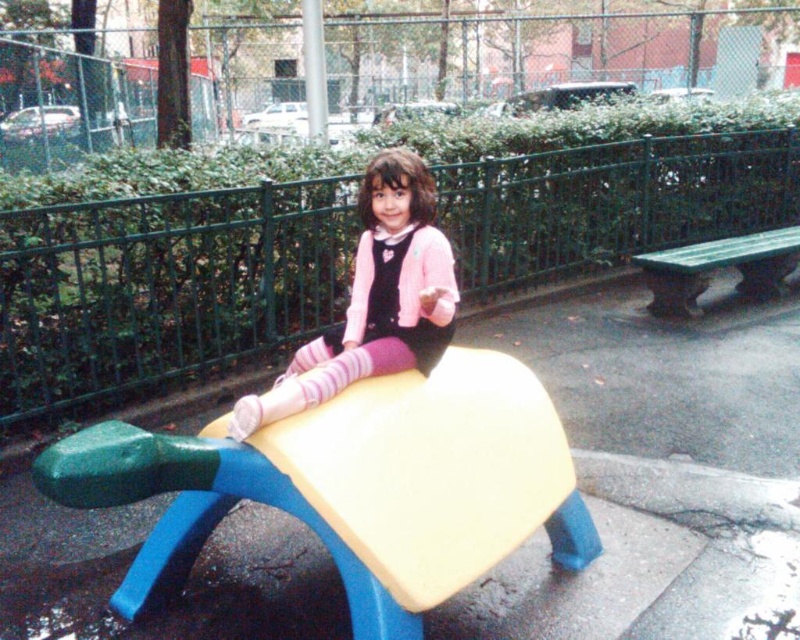
Question: Which object is the closest to the pink matte sweater at center?

Choices:
 (A) green plastic bench at right
 (B) yellow plastic bench at center

Answer: (B)

Question: Considering the real-world distances, which object is farthest from the pink matte sweater at center?

Choices:
 (A) yellow plastic bench at center
 (B) green plastic bench at right

Answer: (B)

Question: Can you confirm if pink matte sweater at center is positioned above green plastic bench at right?

Choices:
 (A) yes
 (B) no

Answer: (B)

Question: Does yellow plastic bench at center appear over green plastic bench at right?

Choices:
 (A) no
 (B) yes

Answer: (A)

Question: Which point is farther to the camera?

Choices:
 (A) yellow plastic bench at center
 (B) pink matte sweater at center
 (C) green plastic bench at right

Answer: (C)

Question: Is yellow plastic bench at center behind green plastic bench at right?

Choices:
 (A) yes
 (B) no

Answer: (B)